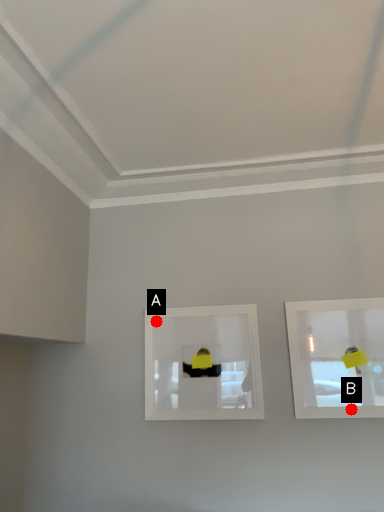
Question: Two points are circled on the image, labeled by A and B beside each circle. Which point is farther from the camera taking this photo?

Choices:
 (A) A is further
 (B) B is further

Answer: (A)